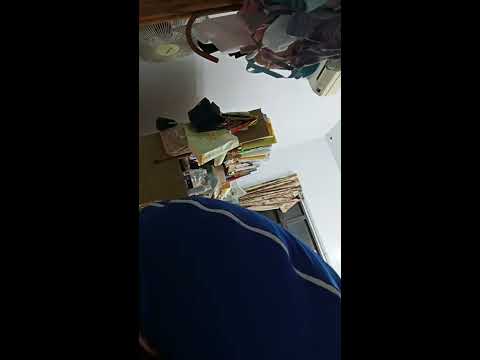
Locate an element on the screen. This screenshot has width=480, height=360. window is located at coordinates pyautogui.click(x=280, y=216).